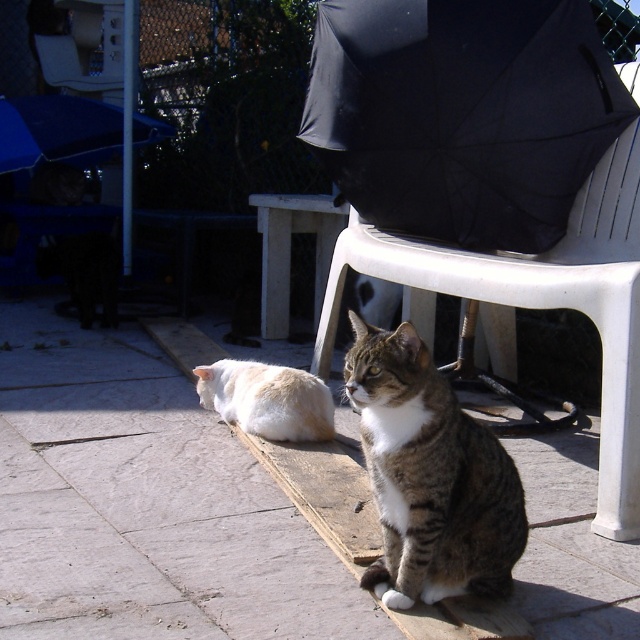
You are setting up a picnic area and need to place a blue fabric umbrella at upper left and a white plastic chair at center. Which object is wider?

The white plastic chair at center is wider than the blue fabric umbrella at upper left.

You are a photographer trying to capture a photo of the white fluffy cat at lower left. There is a blue fabric umbrella at upper left in the way. Can you estimate if the umbrella is wide enough to block the entire cat from view?

The blue fabric umbrella at upper left might be wider than white fluffy cat at lower left, so there is a possibility that the umbrella could block the entire cat from view depending on its exact dimensions and positioning.

Based on the photo, you are a photographer setting up equipment in this outdoor scene. You have a white plastic chair at center and a blue fabric umbrella at upper left. Which object is closer to the right edge of the frame?

The white plastic chair at center is positioned on the right side of blue fabric umbrella at upper left, so the white plastic chair at center is closer to the right edge of the frame.